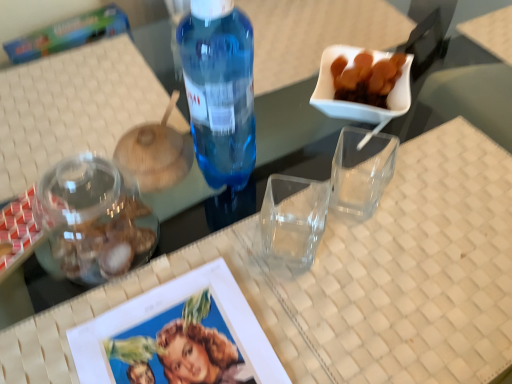
What do you see at coordinates (94, 219) in the screenshot?
I see `clear glass jar at lower left` at bounding box center [94, 219].

Identify the location of clear glass jar at lower left. This screenshot has width=512, height=384. (94, 219).

Measure the distance between point (152, 217) and camera.

The depth of point (152, 217) is 39.25 inches.

What do you see at coordinates (219, 89) in the screenshot?
I see `translucent plastic bottle at center` at bounding box center [219, 89].

I want to click on translucent plastic bottle at center, so click(x=219, y=89).

Where is `clear glass jar at lower left`? The image size is (512, 384). clear glass jar at lower left is located at coordinates (94, 219).

Does clear glass jar at lower left appear on the right side of translucent plastic bottle at center?

In fact, clear glass jar at lower left is to the left of translucent plastic bottle at center.

Is clear glass jar at lower left closer to camera compared to translucent plastic bottle at center?

No, clear glass jar at lower left is behind translucent plastic bottle at center.

Between point (69, 268) and point (203, 101), which one is positioned in front?

The point (203, 101) is closer to the camera.

From the image's perspective, is clear glass jar at lower left under translucent plastic bottle at center?

Yes.

From a real-world perspective, between clear glass jar at lower left and translucent plastic bottle at center, who is vertically higher?

translucent plastic bottle at center.

Is clear glass jar at lower left wider or thinner than translucent plastic bottle at center?

In the image, clear glass jar at lower left appears to be wider than translucent plastic bottle at center.

Considering the sizes of clear glass jar at lower left and translucent plastic bottle at center in the image, is clear glass jar at lower left taller or shorter than translucent plastic bottle at center?

Considering their sizes, clear glass jar at lower left has less height than translucent plastic bottle at center.

Is clear glass jar at lower left smaller than translucent plastic bottle at center?

Yes, clear glass jar at lower left is smaller than translucent plastic bottle at center.

In the scene shown: Is clear glass jar at lower left outside of translucent plastic bottle at center?

Yes.

Is clear glass jar at lower left touching translucent plastic bottle at center?

No, clear glass jar at lower left is not in contact with translucent plastic bottle at center.

Does clear glass jar at lower left turn towards translucent plastic bottle at center?

No, clear glass jar at lower left is not aimed at translucent plastic bottle at center.

Locate an element on the screen. This screenshot has height=384, width=512. bottle that is on the right side of clear glass jar at lower left is located at coordinates (219, 89).

Which is more to the left, translucent plastic bottle at center or clear glass jar at lower left?

clear glass jar at lower left.

Is the depth of translucent plastic bottle at center greater than that of clear glass jar at lower left?

No, translucent plastic bottle at center is closer to the camera.

Is point (225, 5) in front of point (58, 203)?

Yes.

From the image's perspective, is translucent plastic bottle at center positioned above or below clear glass jar at lower left?

translucent plastic bottle at center is above clear glass jar at lower left.

From a real-world perspective, does translucent plastic bottle at center sit lower than clear glass jar at lower left?

Actually, translucent plastic bottle at center is physically above clear glass jar at lower left in the real world.

Between translucent plastic bottle at center and clear glass jar at lower left, which one has larger width?

Wider between the two is clear glass jar at lower left.

Can you confirm if translucent plastic bottle at center is taller than clear glass jar at lower left?

Indeed, translucent plastic bottle at center has a greater height compared to clear glass jar at lower left.

Between translucent plastic bottle at center and clear glass jar at lower left, which one has larger size?

translucent plastic bottle at center.

Which is correct: translucent plastic bottle at center is inside clear glass jar at lower left, or outside of it?

translucent plastic bottle at center is outside clear glass jar at lower left.

Are translucent plastic bottle at center and clear glass jar at lower left making contact?

No, translucent plastic bottle at center is not touching clear glass jar at lower left.

Is translucent plastic bottle at center looking in the opposite direction of clear glass jar at lower left?

No, clear glass jar at lower left is not at the back of translucent plastic bottle at center.

Can you tell me how much translucent plastic bottle at center and clear glass jar at lower left differ in facing direction?

0.000685 degrees.

The height and width of the screenshot is (384, 512). In order to click on tableware behind the translucent plastic bottle at center in this screenshot , I will do `click(94, 219)`.

At what (x,y) coordinates should I click in order to perform the action: click on tableware on the left of translucent plastic bottle at center. Please return your answer as a coordinate pair (x, y). The height and width of the screenshot is (384, 512). Looking at the image, I should click on (94, 219).

In the image, there is a clear glass jar at lower left. Identify the location of bottle above it (from the image's perspective). (219, 89).